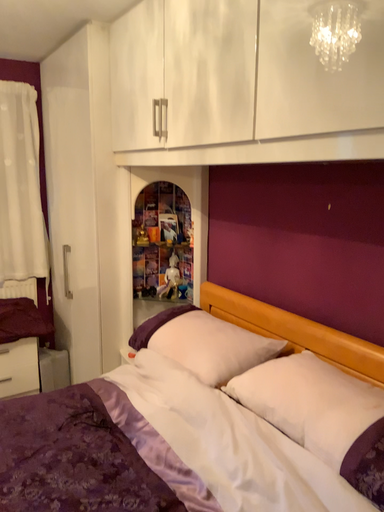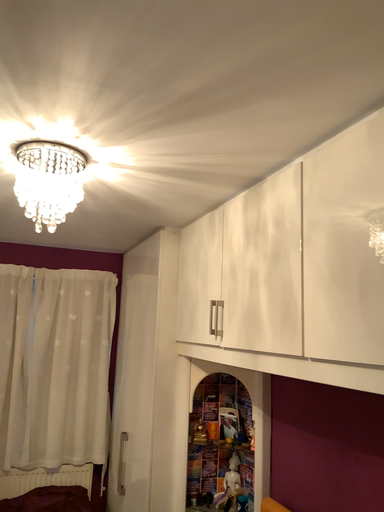
Question: Which way did the camera rotate in the video?

Choices:
 (A) rotated upward
 (B) rotated downward

Answer: (A)